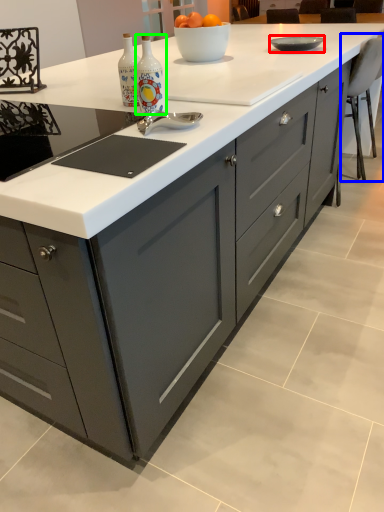
Question: Estimate the real-world distances between objects in this image. Which object is closer to bowl (highlighted by a red box), chair (highlighted by a blue box) or bottle (highlighted by a green box)?

Choices:
 (A) chair
 (B) bottle

Answer: (A)